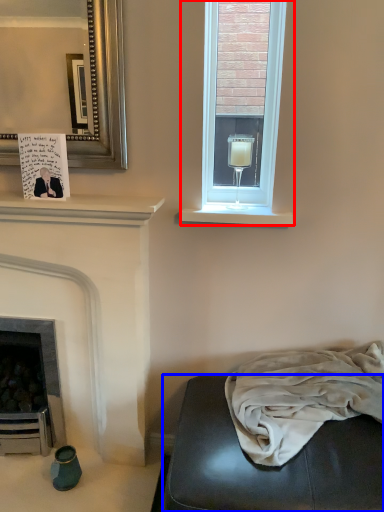
Question: Among these objects, which one is farthest to the camera, window (highlighted by a red box) or studio couch (highlighted by a blue box)?

Choices:
 (A) window
 (B) studio couch

Answer: (A)